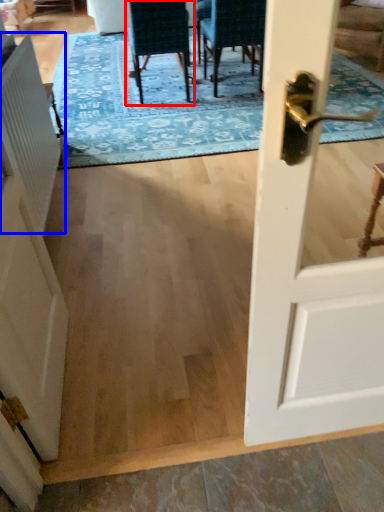
Question: Among these objects, which one is nearest to the camera, chair (highlighted by a red box) or radiator (highlighted by a blue box)?

Choices:
 (A) chair
 (B) radiator

Answer: (B)